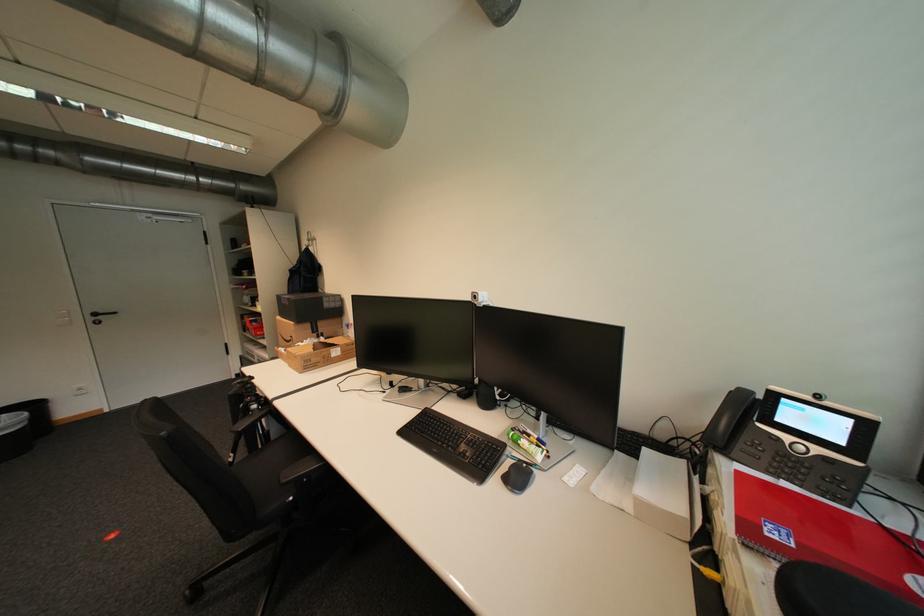
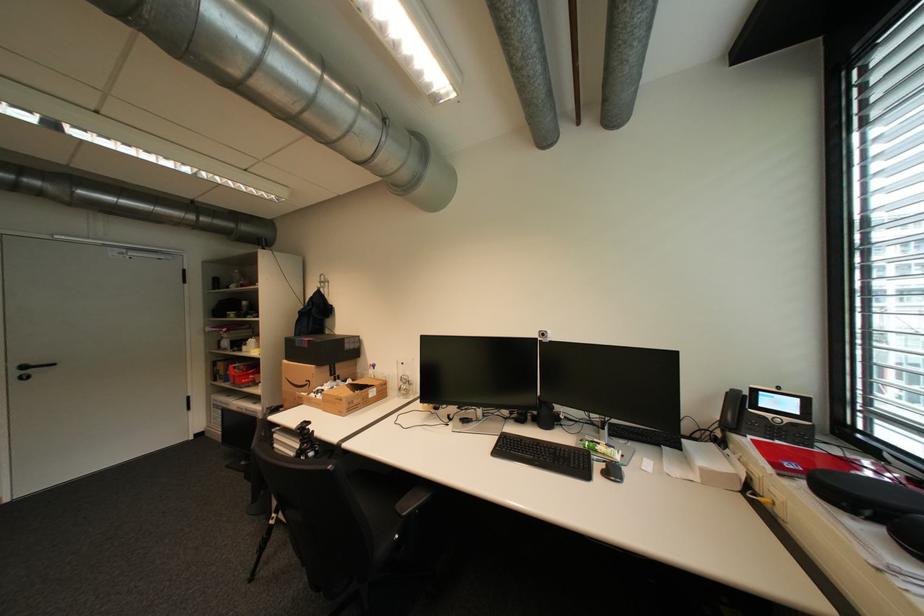
Find the pixel in the second image that matches (514,467) in the first image.

(606, 467)